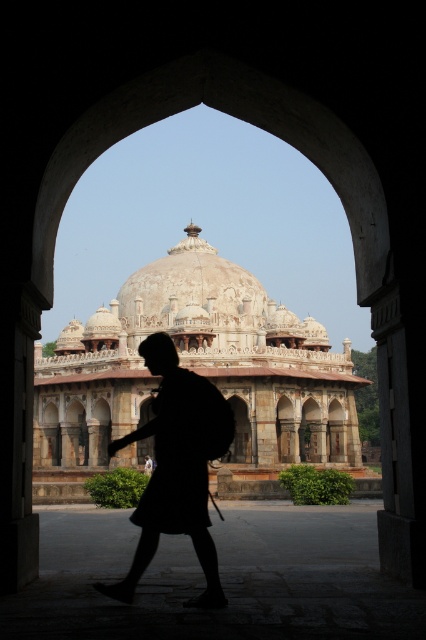
Is white stone dome at center wider than black matte backpack at center?

Correct, the width of white stone dome at center exceeds that of black matte backpack at center.

Locate an element on the screen. The width and height of the screenshot is (426, 640). white stone dome at center is located at coordinates (195, 371).

Where is `white stone dome at center`? The height and width of the screenshot is (640, 426). white stone dome at center is located at coordinates (195, 371).

The width and height of the screenshot is (426, 640). Identify the location of white stone dome at center. (195, 371).